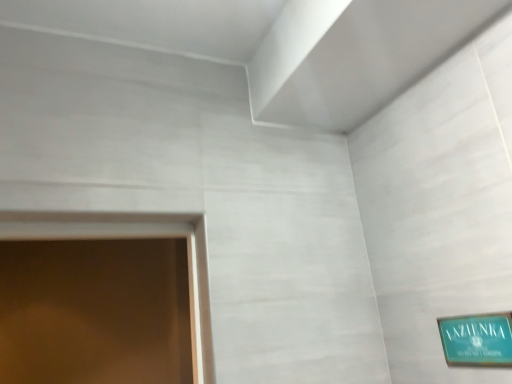
At what (x,y) coordinates should I click in order to perform the action: click on green matte sign at lower right. Please return your answer as a coordinate pair (x, y). Looking at the image, I should click on 477,340.

What is the approximate height of green matte sign at lower right?

green matte sign at lower right is 4.47 inches in height.

Describe the element at coordinates (477, 340) in the screenshot. I see `green matte sign at lower right` at that location.

I want to click on green matte sign at lower right, so click(477, 340).